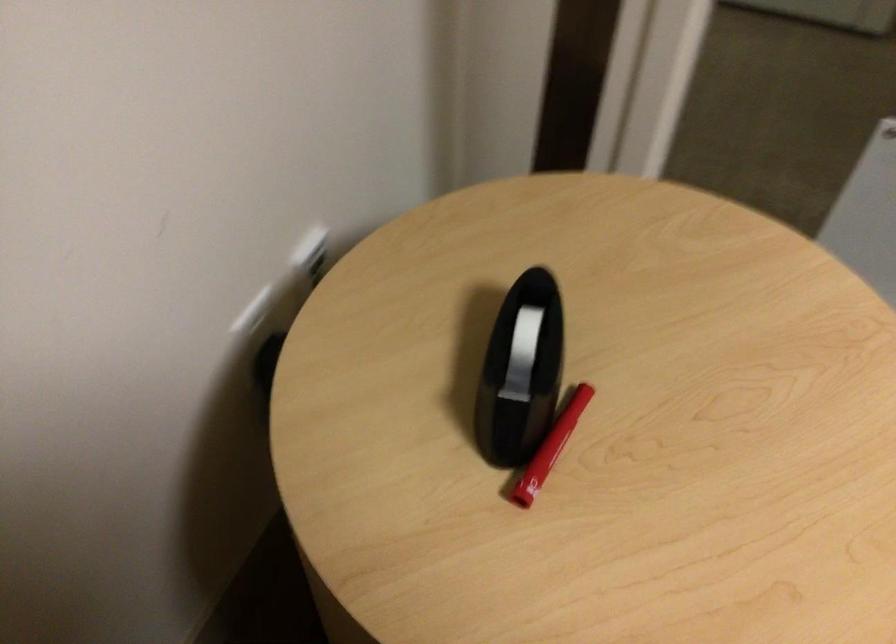
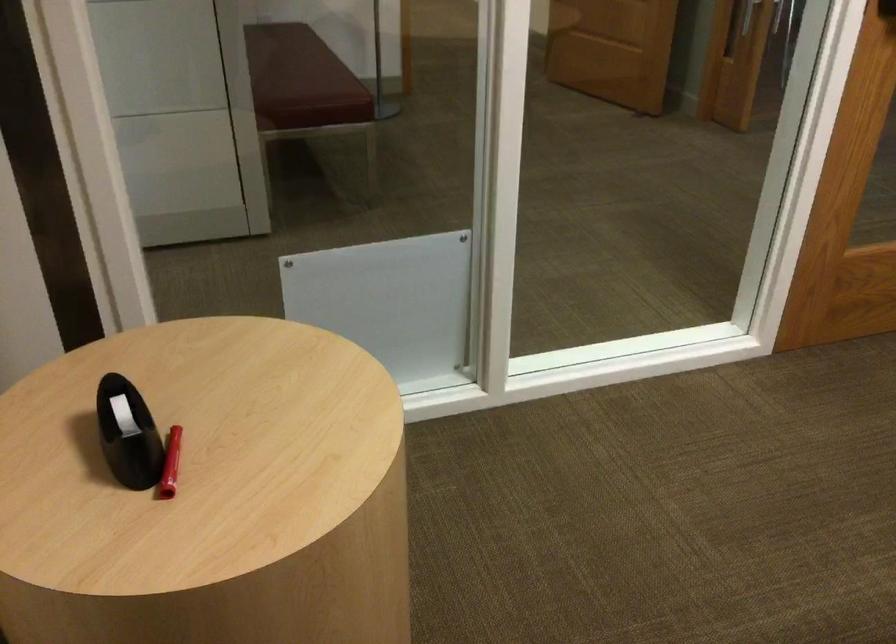
Locate, in the second image, the point that corresponds to [554,440] in the first image.

(170, 464)